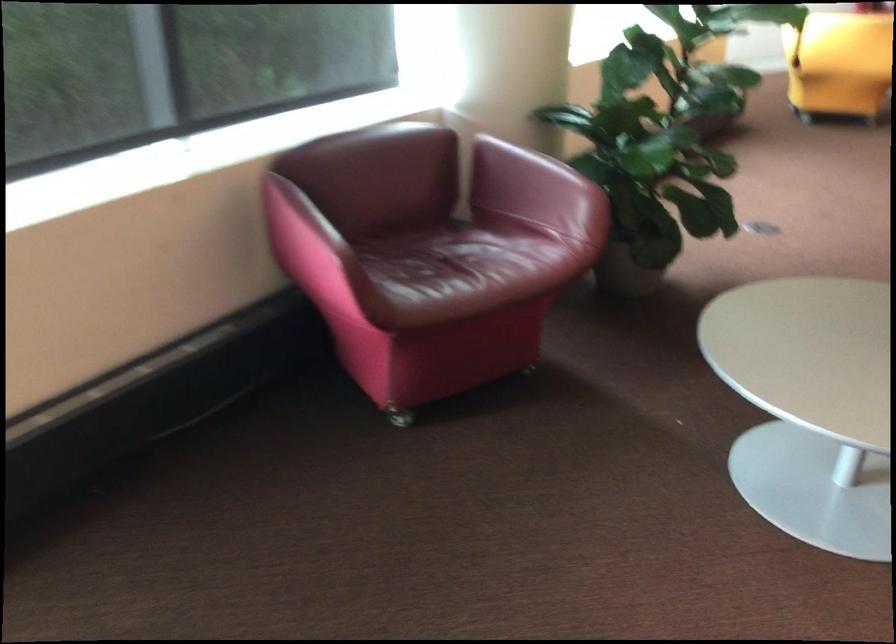
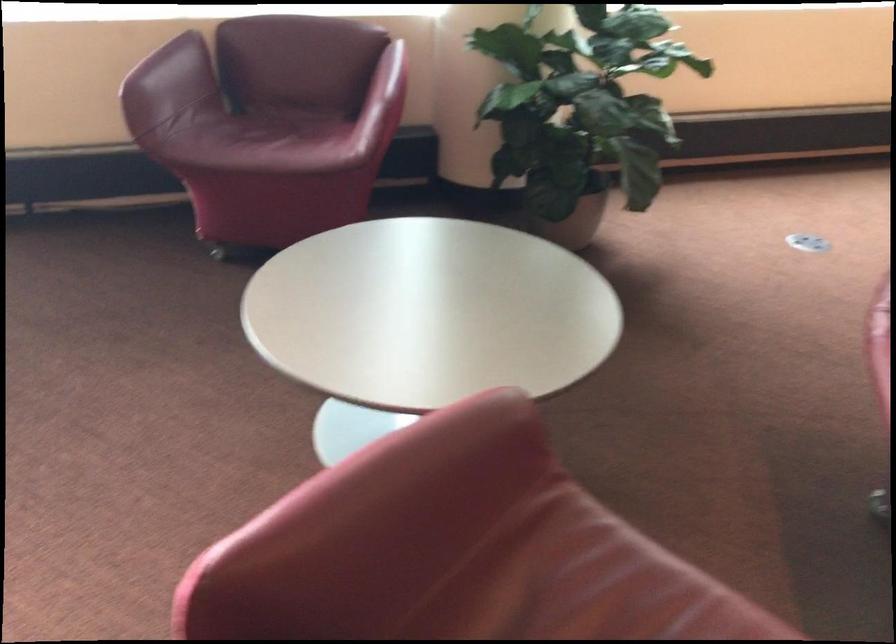
Find the pixel in the second image that matches the point at 293,209 in the first image.

(165, 57)